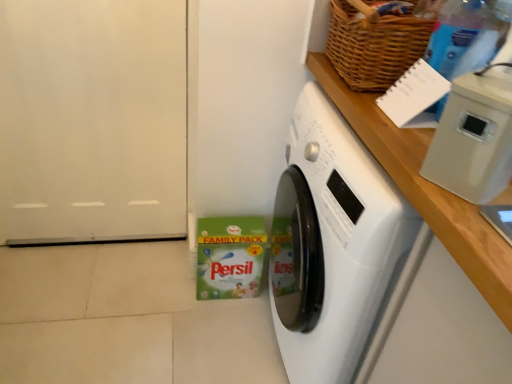
Question: Would you say white matte door at left is inside or outside white glossy washing machine at center?

Choices:
 (A) inside
 (B) outside

Answer: (B)

Question: From a real-world perspective, is white matte door at left above or below white glossy washing machine at center?

Choices:
 (A) above
 (B) below

Answer: (A)

Question: Which object is the farthest from the white glossy washing machine at center?

Choices:
 (A) white matte door at left
 (B) white plastic container at upper right
 (C) transparent plastic bottle at upper right
 (D) woven brown basket at upper right

Answer: (A)

Question: Which of these objects is positioned farthest from the white glossy washing machine at center?

Choices:
 (A) transparent plastic bottle at upper right
 (B) white plastic container at upper right
 (C) woven brown basket at upper right
 (D) white matte door at left

Answer: (D)